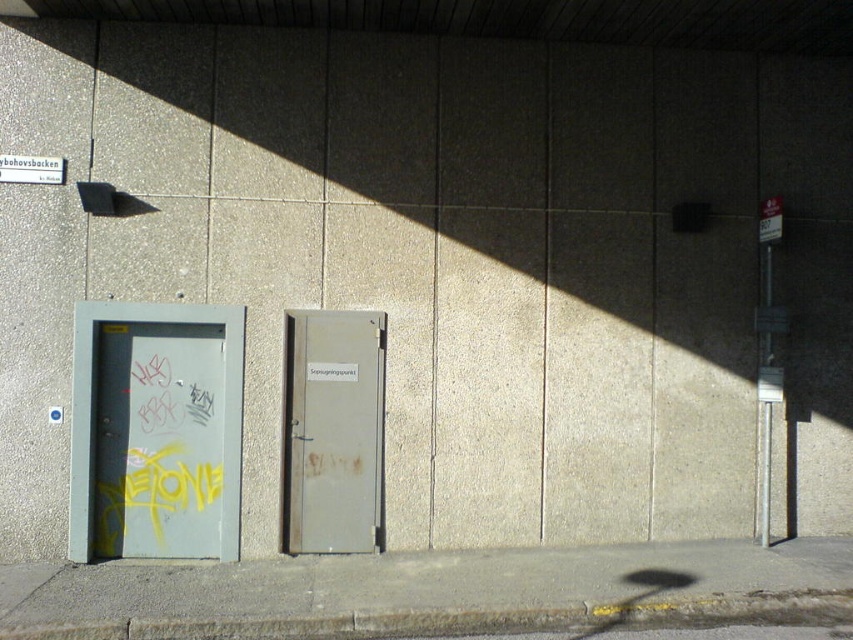
Which is more to the right, metallic gray door at left or rusty metal door at center?

From the viewer's perspective, rusty metal door at center appears more on the right side.

Is metallic gray door at left above rusty metal door at center?

Yes.

In order to click on metallic gray door at left in this screenshot , I will do `click(155, 429)`.